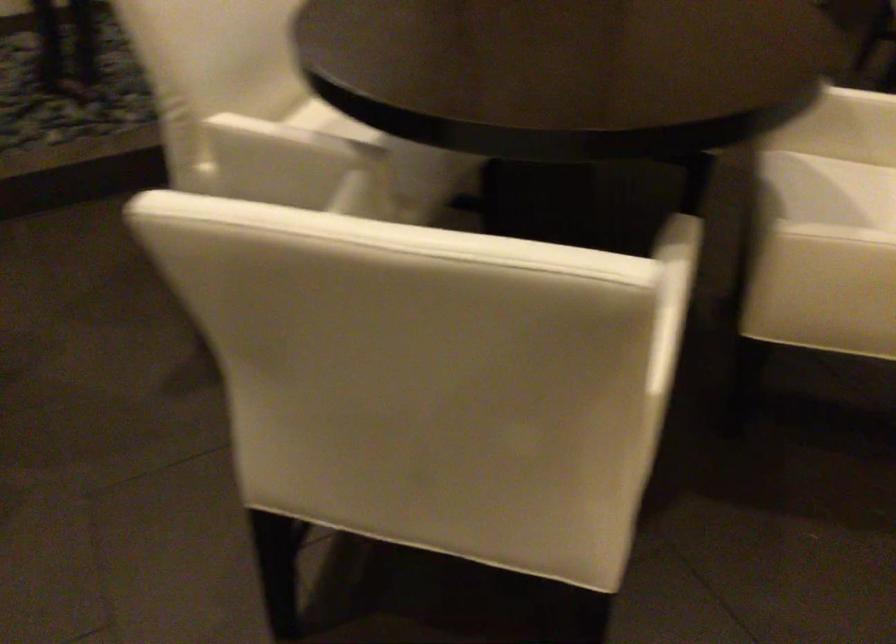
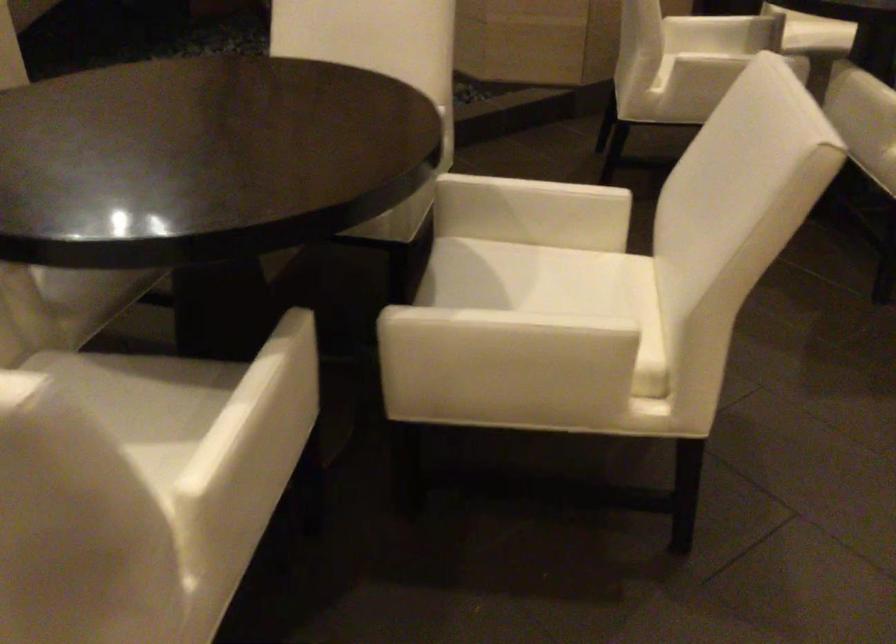
Question: The images are taken continuously from a first-person perspective. In which direction are you moving?

Choices:
 (A) Left
 (B) Right
 (C) Forward
 (D) Backward

Answer: (B)